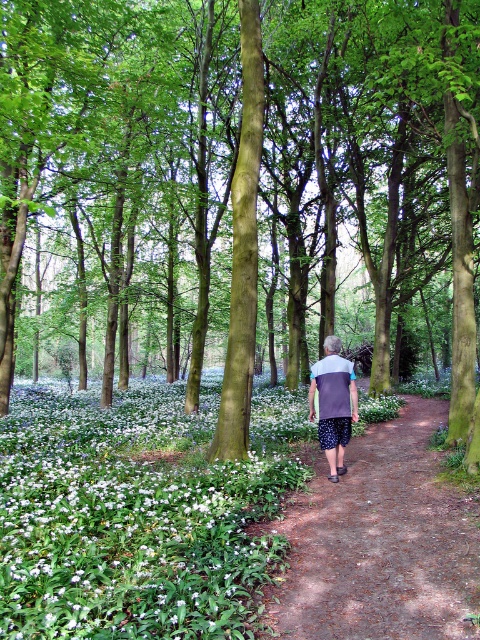
You are standing at the point labeled point (201, 611) and want to walk towards the point labeled point (328, 426). Based on the scene, will you be moving towards the camera or away from it?

Since point (201, 611) is closer to the camera than point (328, 426), moving from point (201, 611) to point (328, 426) means you are moving away from the camera.